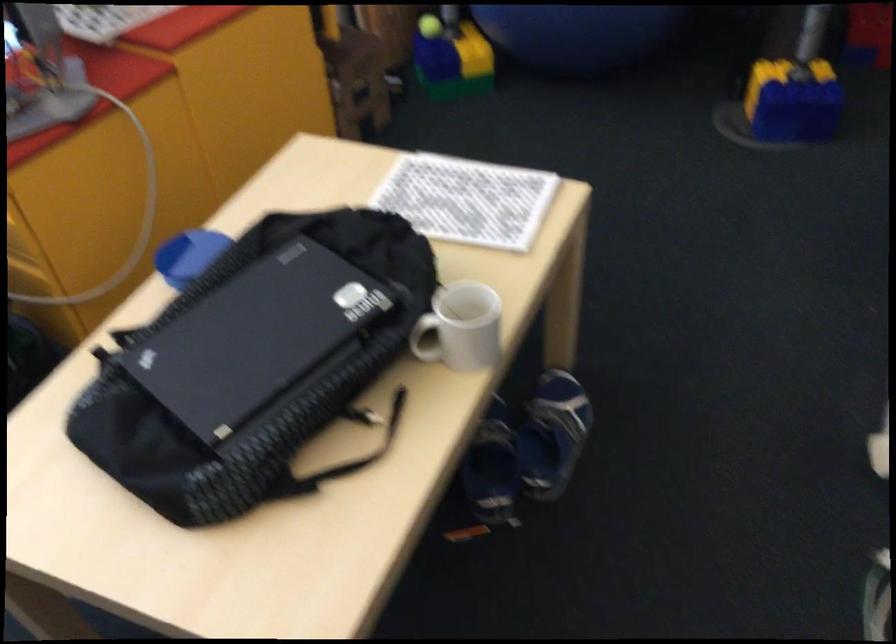
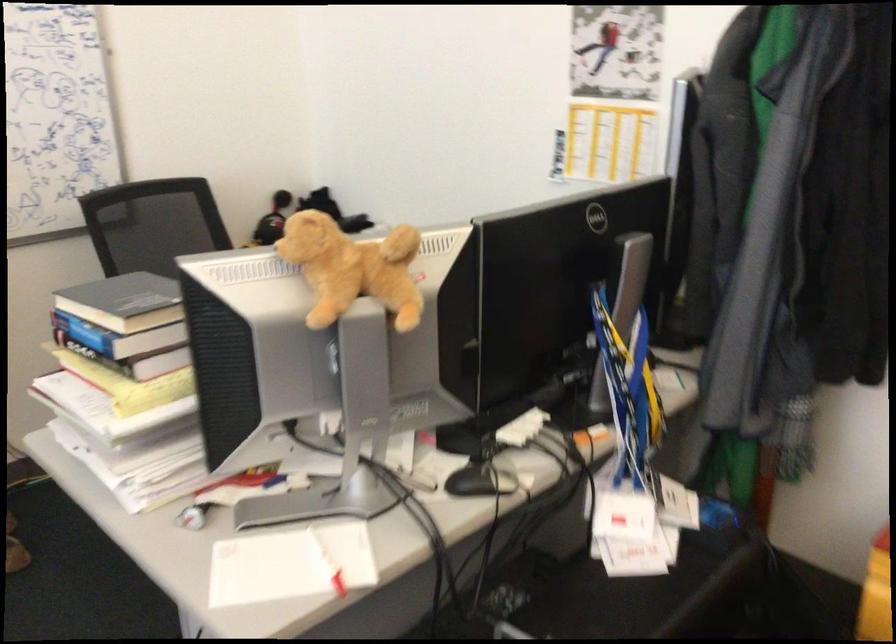
Question: How did the camera likely rotate?

Choices:
 (A) Left
 (B) Right
 (C) Up
 (D) Down

Answer: (B)